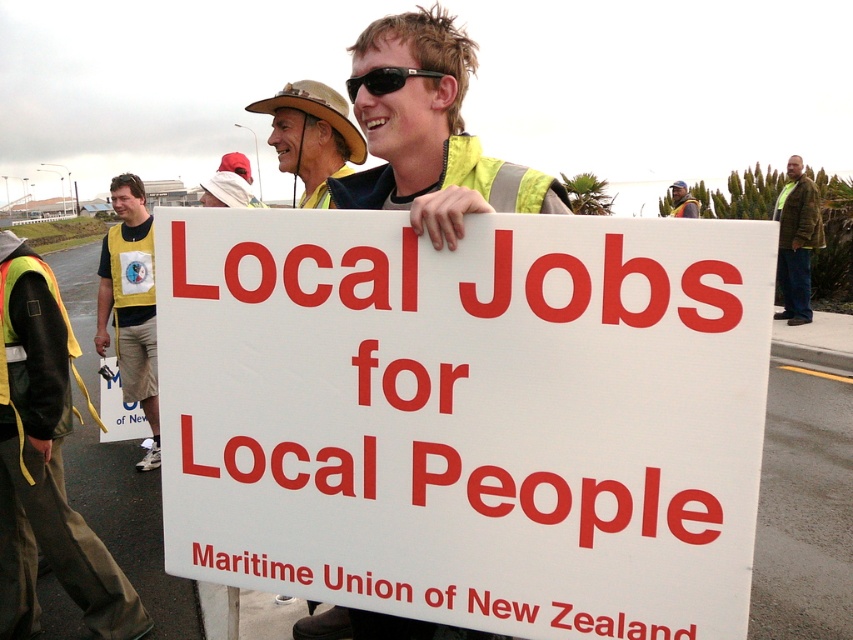
Question: Which of the following is the farthest from the observer?

Choices:
 (A) white paper sign at center
 (B) camouflage jacket at right

Answer: (B)

Question: Which object appears closest to the camera in this image?

Choices:
 (A) camouflage jacket at right
 (B) black plastic sunglasses at center

Answer: (B)

Question: Can you confirm if yellow reflective vest at left is positioned to the right of black plastic sunglasses at center?

Choices:
 (A) yes
 (B) no

Answer: (B)

Question: Can you confirm if reflective yellow vest at left is positioned below yellow reflective safety vest at left?

Choices:
 (A) no
 (B) yes

Answer: (B)

Question: Among these points, which one is farthest from the camera?

Choices:
 (A) (136, 342)
 (B) (802, 294)
 (C) (688, 209)
 (D) (393, 81)

Answer: (C)

Question: Does white paper sign at center have a greater width compared to yellow reflective vest at left?

Choices:
 (A) yes
 (B) no

Answer: (A)